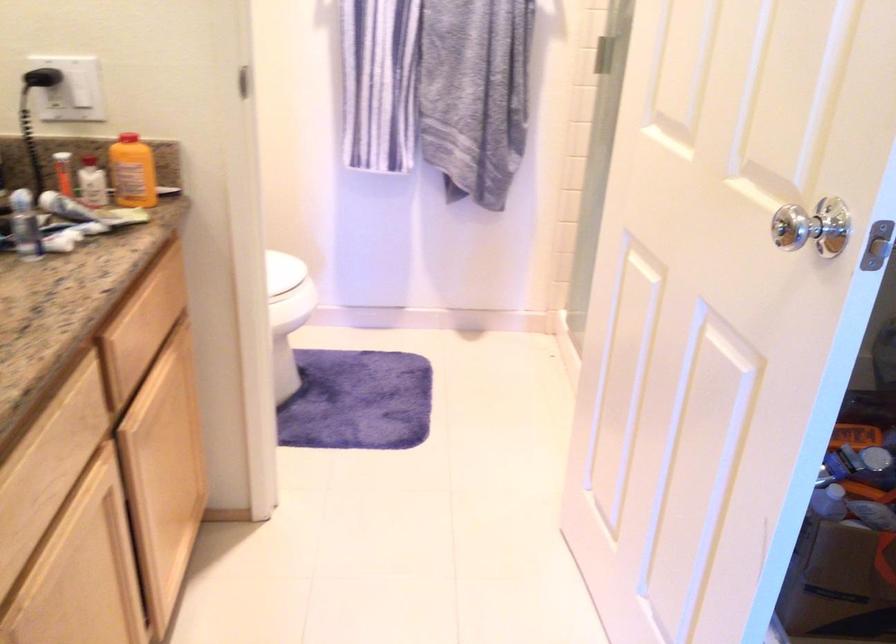
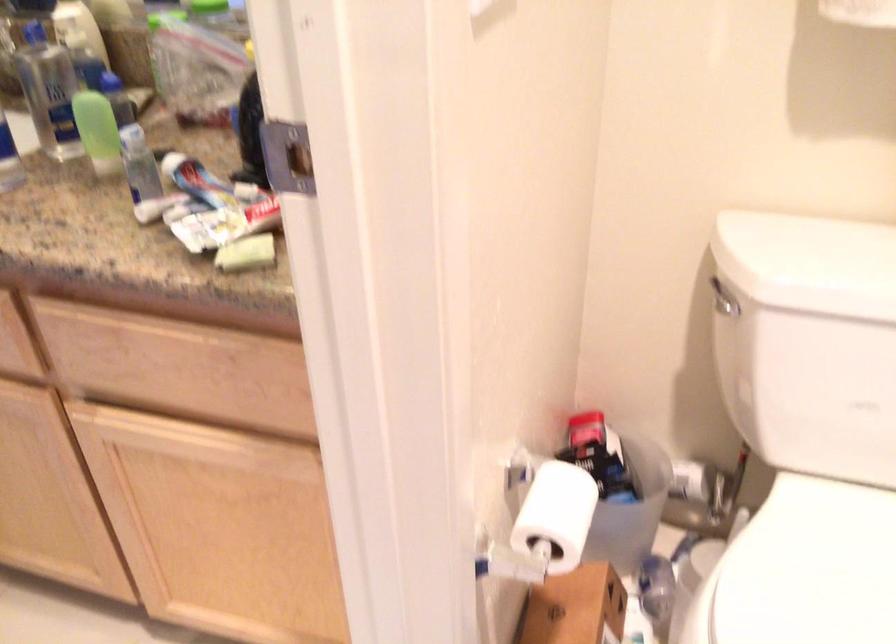
Question: I am providing you with two images of the same scene from different viewpoints. Please identify which objects are invisible in image2.

Choices:
 (A) white marker
 (B) toilet flush handle
 (C) white bottle
 (D) toilet tank lid

Answer: (C)